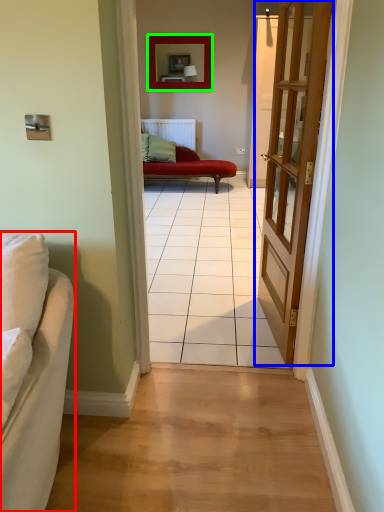
Question: Which object is positioned farthest from studio couch (highlighted by a red box)? Select from door (highlighted by a blue box) and picture frame (highlighted by a green box).

Choices:
 (A) door
 (B) picture frame

Answer: (B)